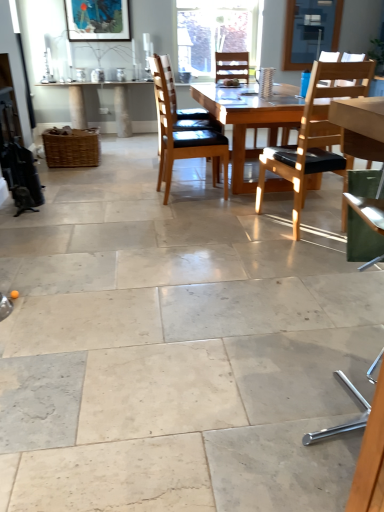
You are a GUI agent. You are given a task and a screenshot of the screen. Output one action in this format:
    pyautogui.click(x=<x>, y=<y>)
    Task: Click on the unoccupied area behind green fabric chair at right, the 3th chair from the back
    The width and height of the screenshot is (384, 512).
    Given the screenshot: What is the action you would take?
    (x=311, y=349)